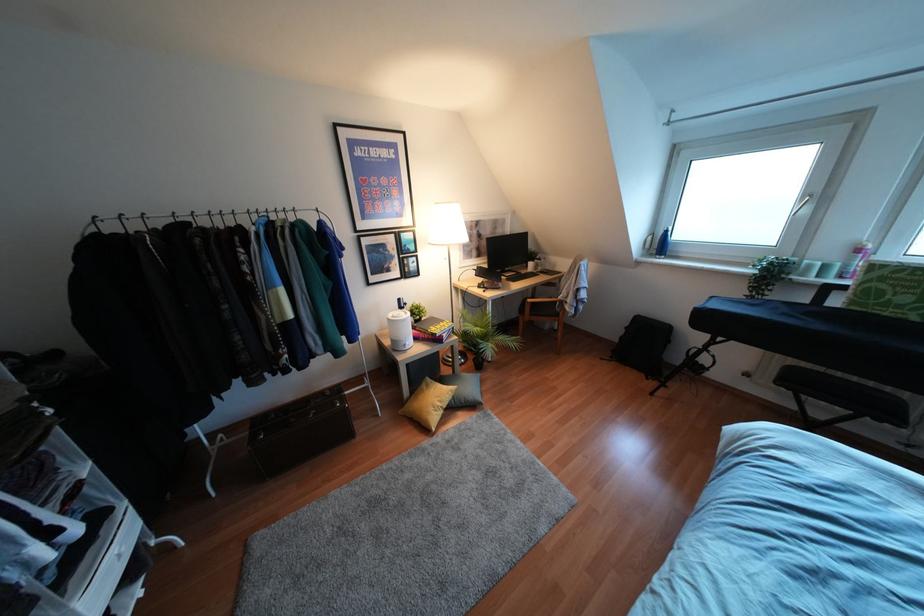
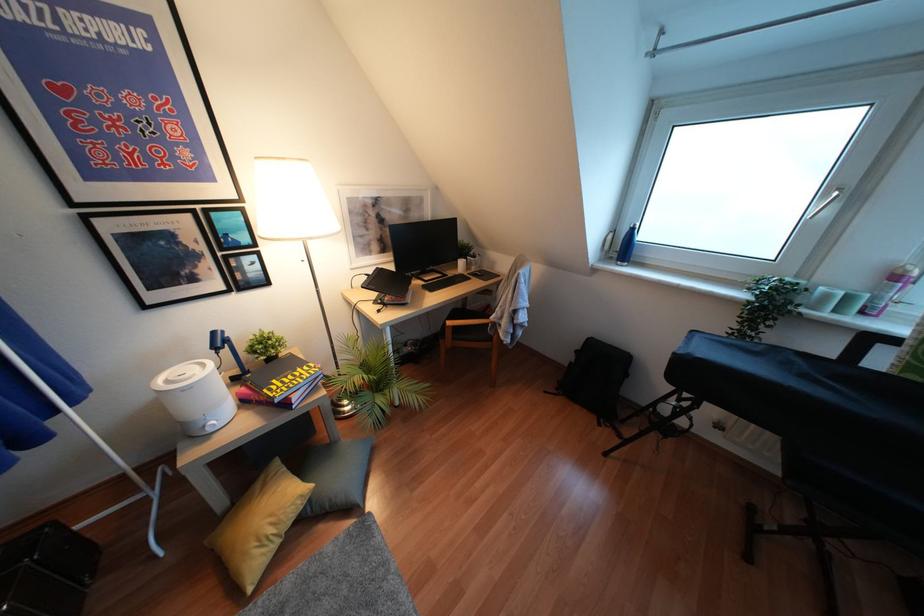
The point at (407, 347) is marked in the first image. Where is the corresponding point in the second image?

(210, 430)